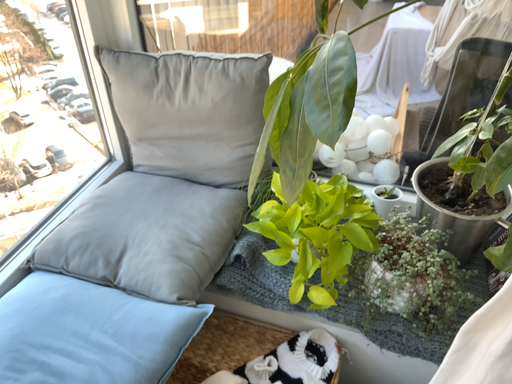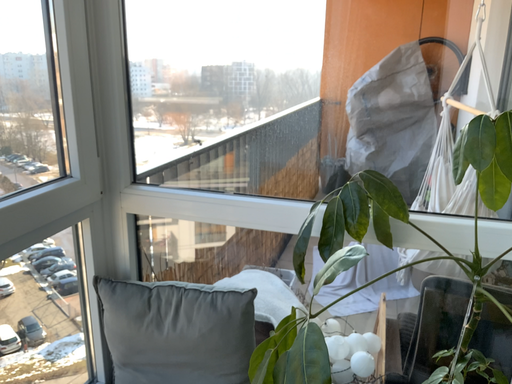
Question: How did the camera likely rotate when shooting the video?

Choices:
 (A) rotated upward
 (B) rotated downward

Answer: (A)